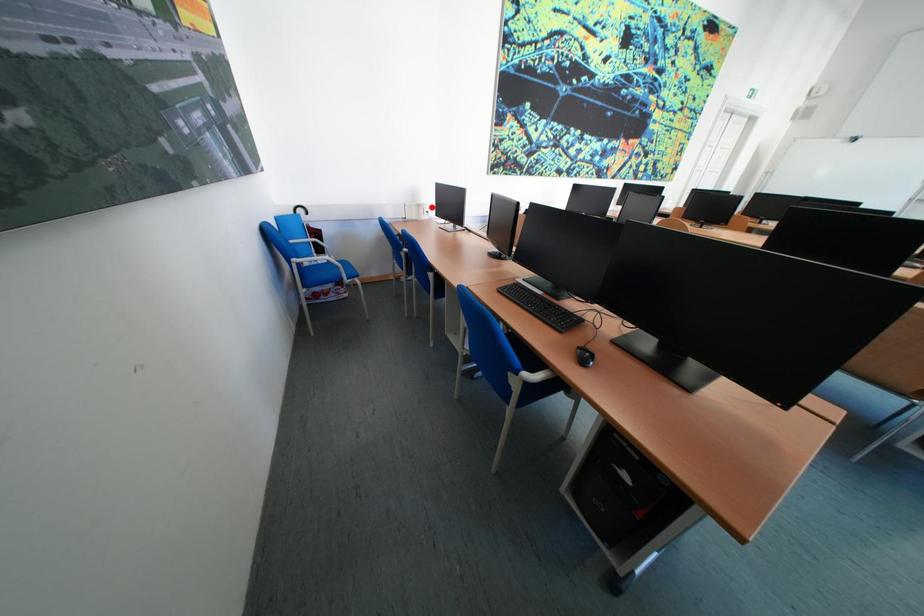
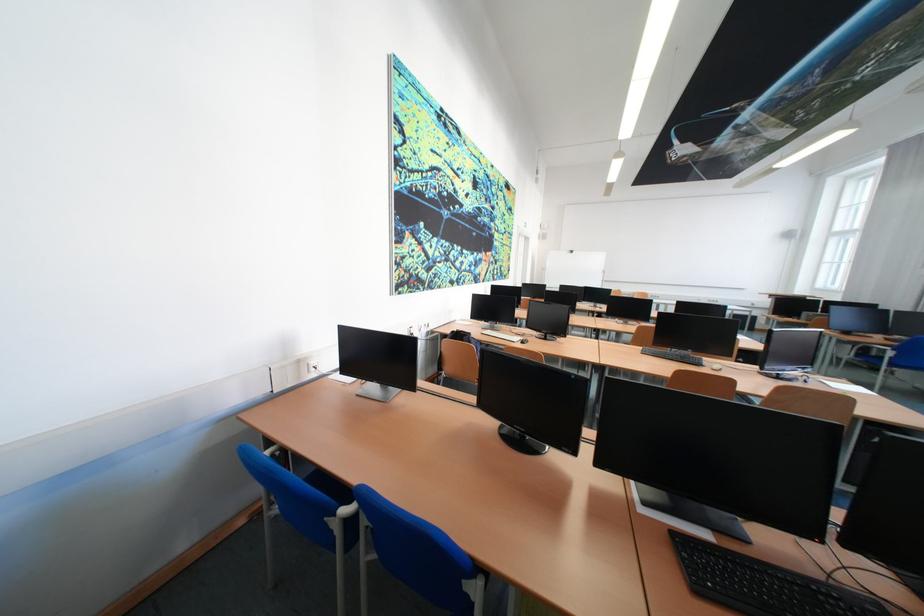
Question: A red point is marked in image1. In image2, is the corresponding 3D point closer to the camera or farther? Reply with the corresponding letter.

Choices:
 (A) The corresponding 3D point is closer.
 (B) The corresponding 3D point is farther.

Answer: (B)